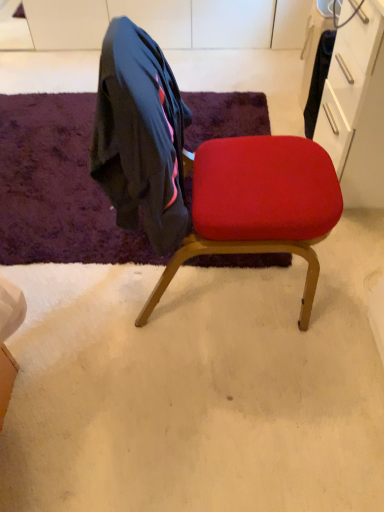
You are a GUI agent. You are given a task and a screenshot of the screen. Output one action in this format:
    pyautogui.click(x=<x>, y=<y>)
    Task: Click on the purple shaggy rug at upper left
    The height and width of the screenshot is (512, 384).
    Given the screenshot: What is the action you would take?
    pyautogui.click(x=57, y=187)

What do you see at coordinates (57, 187) in the screenshot? I see `purple shaggy rug at upper left` at bounding box center [57, 187].

Describe the element at coordinates (202, 172) in the screenshot. I see `velvet red chair at center` at that location.

I want to click on velvet red chair at center, so click(202, 172).

Locate an element on the screen. The height and width of the screenshot is (512, 384). purple shaggy rug at upper left is located at coordinates (57, 187).

Does velvet red chair at center appear on the left side of purple shaggy rug at upper left?

No.

In the image, is velvet red chair at center positioned in front of or behind purple shaggy rug at upper left?

velvet red chair at center is in front of purple shaggy rug at upper left.

Does point (302, 142) come farther from viewer compared to point (23, 203)?

No.

From the image's perspective, is velvet red chair at center over purple shaggy rug at upper left?

Incorrect, from the image's perspective, velvet red chair at center is lower than purple shaggy rug at upper left.

From a real-world perspective, does velvet red chair at center sit lower than purple shaggy rug at upper left?

No.

Does velvet red chair at center have a greater width compared to purple shaggy rug at upper left?

No, velvet red chair at center is not wider than purple shaggy rug at upper left.

Considering the relative sizes of velvet red chair at center and purple shaggy rug at upper left in the image provided, is velvet red chair at center taller than purple shaggy rug at upper left?

Indeed, velvet red chair at center has a greater height compared to purple shaggy rug at upper left.

Does velvet red chair at center have a smaller size compared to purple shaggy rug at upper left?

No, velvet red chair at center is not smaller than purple shaggy rug at upper left.

Can we say velvet red chair at center lies outside purple shaggy rug at upper left?

That's correct, velvet red chair at center is outside of purple shaggy rug at upper left.

Does velvet red chair at center touch purple shaggy rug at upper left?

No, velvet red chair at center is not with purple shaggy rug at upper left.

Is velvet red chair at center aimed at purple shaggy rug at upper left?

No.

Can you tell me how much velvet red chair at center and purple shaggy rug at upper left differ in facing direction?

There is a 92-degree angle between the facing directions of velvet red chair at center and purple shaggy rug at upper left.

Where is `chair located in front of the purple shaggy rug at upper left`? The image size is (384, 512). chair located in front of the purple shaggy rug at upper left is located at coordinates (202, 172).

Does purple shaggy rug at upper left appear on the right side of velvet red chair at center?

No, purple shaggy rug at upper left is not to the right of velvet red chair at center.

Is purple shaggy rug at upper left closer to camera compared to velvet red chair at center?

That is False.

Does point (74, 110) come in front of point (221, 228)?

No, it is behind (221, 228).

From the image's perspective, would you say purple shaggy rug at upper left is shown under velvet red chair at center?

No, from the image's perspective, purple shaggy rug at upper left is not below velvet red chair at center.

From a real-world perspective, which object rests below the other?

In real-world perspective, purple shaggy rug at upper left is lower.

Which object is wider, purple shaggy rug at upper left or velvet red chair at center?

With larger width is purple shaggy rug at upper left.

Between purple shaggy rug at upper left and velvet red chair at center, which one has more height?

velvet red chair at center.

Considering the relative sizes of purple shaggy rug at upper left and velvet red chair at center in the image provided, is purple shaggy rug at upper left smaller than velvet red chair at center?

Yes, purple shaggy rug at upper left is smaller than velvet red chair at center.

Would you say purple shaggy rug at upper left is outside velvet red chair at center?

That's correct, purple shaggy rug at upper left is outside of velvet red chair at center.

Is purple shaggy rug at upper left placed right next to velvet red chair at center?

No, purple shaggy rug at upper left is not with velvet red chair at center.

Is velvet red chair at center at the back of purple shaggy rug at upper left?

No, velvet red chair at center is not at the back of purple shaggy rug at upper left.

Measure the distance between purple shaggy rug at upper left and velvet red chair at center.

purple shaggy rug at upper left is 60.43 centimeters away from velvet red chair at center.

Locate an element on the screen. The image size is (384, 512). chair in front of the purple shaggy rug at upper left is located at coordinates (202, 172).

This screenshot has height=512, width=384. In order to click on chair above the purple shaggy rug at upper left (from a real-world perspective) in this screenshot , I will do `click(202, 172)`.

This screenshot has width=384, height=512. In order to click on mat on the left of velvet red chair at center in this screenshot , I will do `click(57, 187)`.